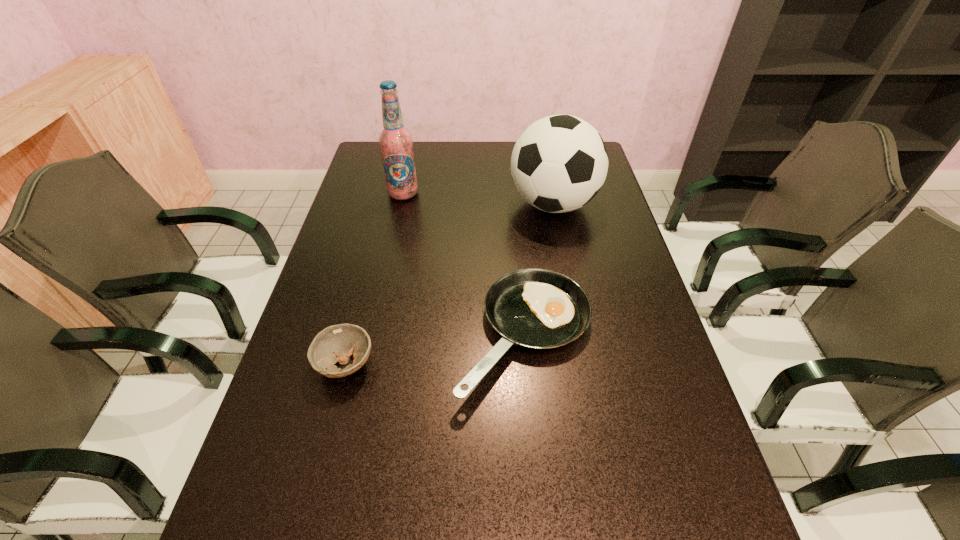
The image size is (960, 540). Identify the location of object that is at the right edge. (559, 163).

In the image, there is a desktop. Where is `vacant space at the far edge`? vacant space at the far edge is located at coordinates (443, 145).

At what (x,y) coordinates should I click in order to perform the action: click on vacant region at the left edge of the desktop. Please return your answer as a coordinate pair (x, y). Looking at the image, I should click on coord(383,206).

Identify the location of vacant area at the right edge. (636, 300).

At what (x,y) coordinates should I click in order to perform the action: click on free space between the tallest object and the frying pan. Please return your answer as a coordinate pair (x, y). Image resolution: width=960 pixels, height=540 pixels. Looking at the image, I should click on (465, 265).

I want to click on vacant region between the frying pan and the alcohol, so click(465, 265).

Find the location of a particular element. The image size is (960, 540). vacant area that lies between the bowl and the alcohol is located at coordinates (374, 279).

Find the location of a particular element. This screenshot has height=540, width=960. free point between the bowl and the second tallest object is located at coordinates (449, 284).

The height and width of the screenshot is (540, 960). Find the location of `free spot between the alcohol and the frying pan`. free spot between the alcohol and the frying pan is located at coordinates (465, 265).

In order to click on free space between the alcohol and the soccer ball in this screenshot , I will do `click(478, 199)`.